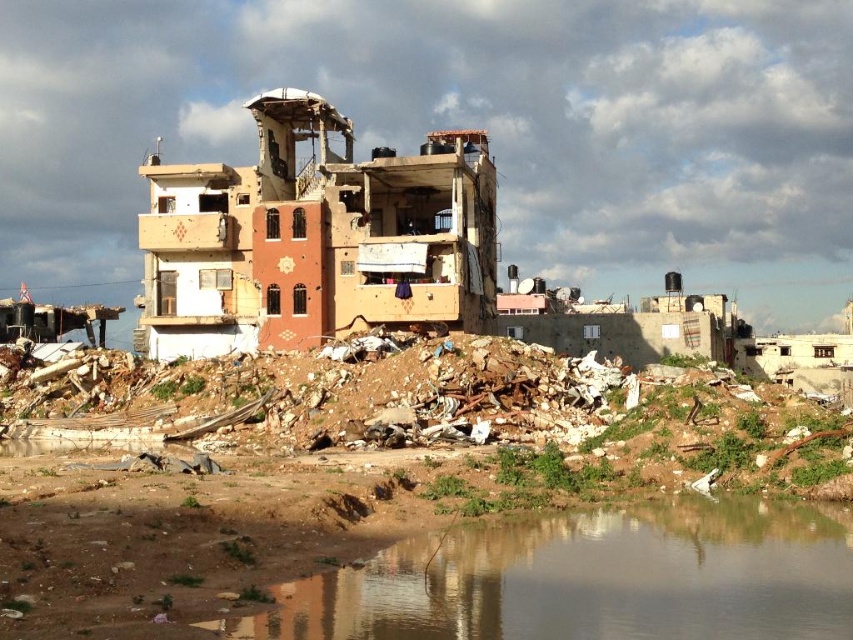
Does brown textured building at center have a lesser height compared to brown dirt at lower center?

Incorrect, brown textured building at center's height does not fall short of brown dirt at lower center's.

Does brown textured building at center have a greater height compared to brown dirt at lower center?

Correct, brown textured building at center is much taller as brown dirt at lower center.

This screenshot has width=853, height=640. I want to click on brown textured building at center, so click(x=316, y=237).